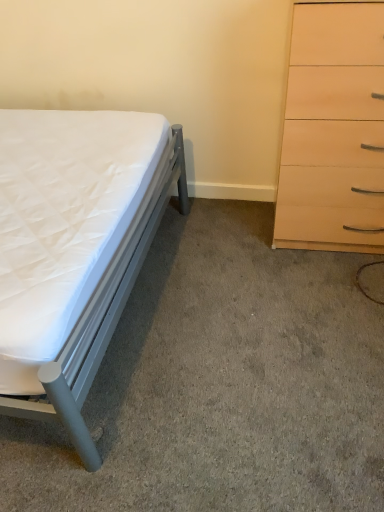
You are a GUI agent. You are given a task and a screenshot of the screen. Output one action in this format:
    pyautogui.click(x=<x>, y=<y>)
    Task: Click on the free space to the left of light wood/finish chest of drawers at right
    
    Given the screenshot: What is the action you would take?
    pyautogui.click(x=228, y=239)